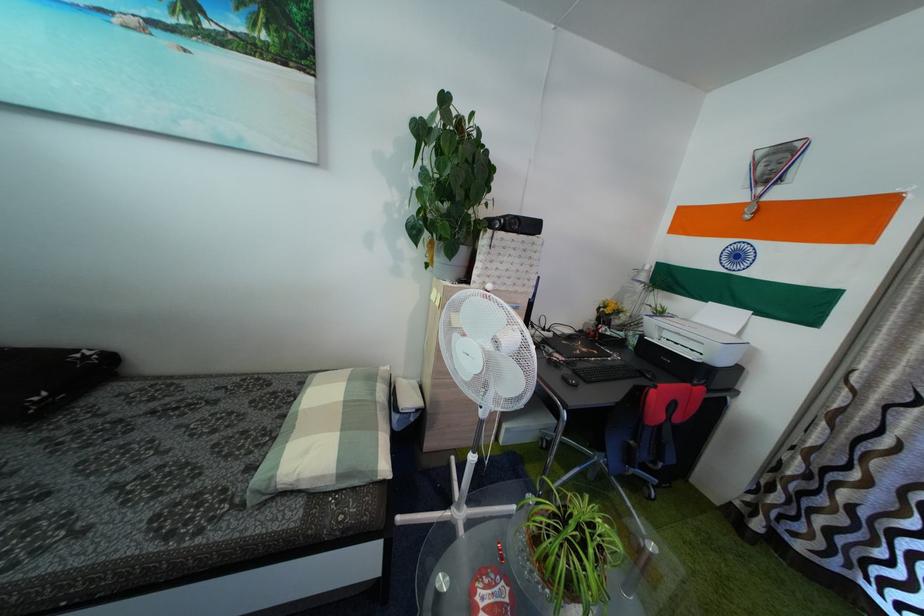
This screenshot has height=616, width=924. What do you see at coordinates (330, 436) in the screenshot?
I see `a plaid checkered pillow` at bounding box center [330, 436].